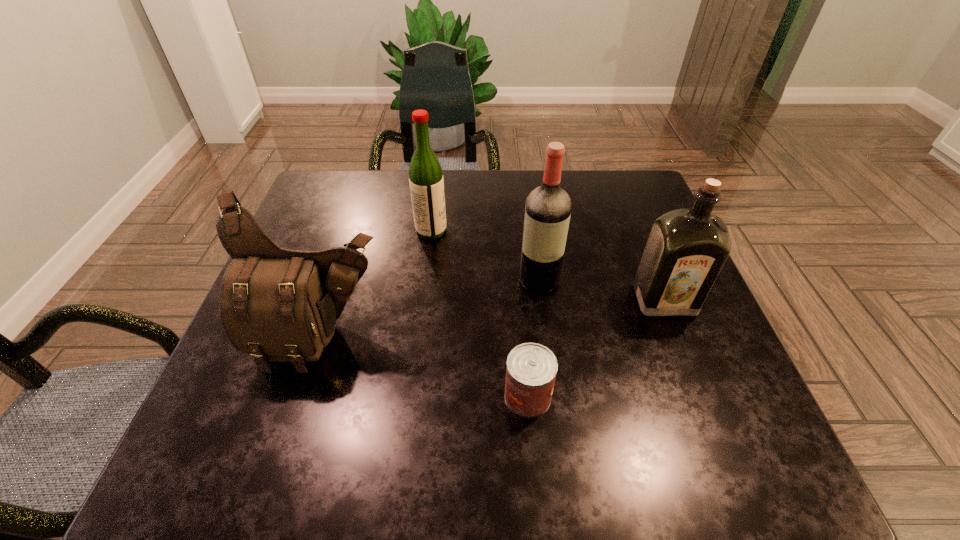
This screenshot has width=960, height=540. I want to click on the second liquor from left to right, so click(x=548, y=208).

I want to click on the farthest liquor, so click(426, 181).

You are a GUI agent. You are given a task and a screenshot of the screen. Output one action in this format:
    pyautogui.click(x=<x>, y=<y>)
    Task: Click on the leftmost liquor
    The height and width of the screenshot is (540, 960).
    Given the screenshot: What is the action you would take?
    pyautogui.click(x=426, y=181)

I want to click on shoulder bag, so click(x=279, y=305).

Locate an element on the screen. Image resolution: width=960 pixels, height=540 pixels. the rightmost liquor is located at coordinates (686, 248).

Find the location of `the nearest object`. the nearest object is located at coordinates (531, 369).

Identify the location of can. (531, 369).

Find the location of a particular element. The height and width of the screenshot is (540, 960). vacant point located on the front-facing side of the second liquor from right to left is located at coordinates (549, 359).

Where is `free location located 0.060m on the label of the second object from left to right`? Image resolution: width=960 pixels, height=540 pixels. free location located 0.060m on the label of the second object from left to right is located at coordinates (470, 231).

At what (x,y) coordinates should I click in order to perform the action: click on vacant region located 0.130m on the front-facing side of the leftmost object. Please return your answer as a coordinate pair (x, y). Looking at the image, I should click on (289, 442).